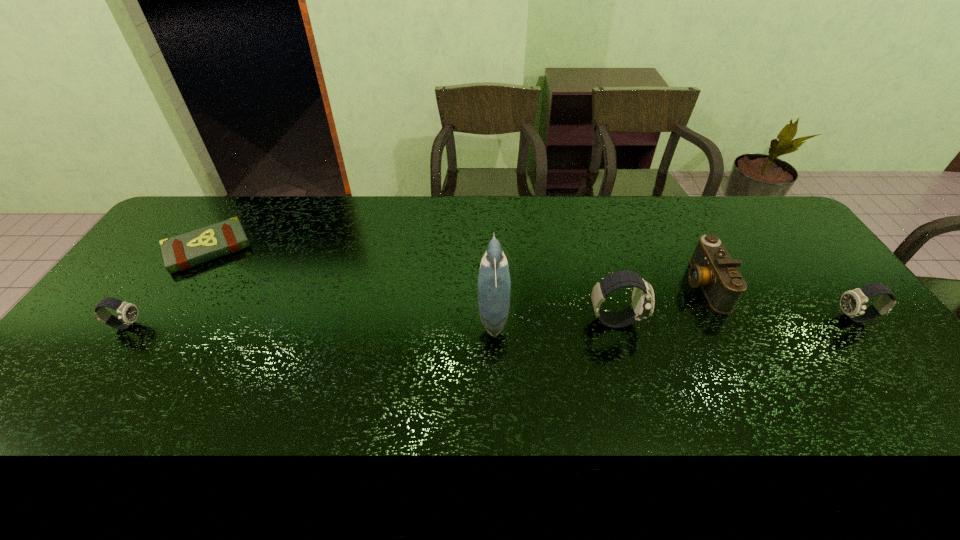
If equal spacing is desired by inserting an extra watch among them, please point out a free spot for this new watch. Please provide its 2D coordinates. Your answer should be formatted as a tuple, i.e. [(x, y)], where the tuple contains the x and y coordinates of a point satisfying the conditions above.

[(372, 323)]